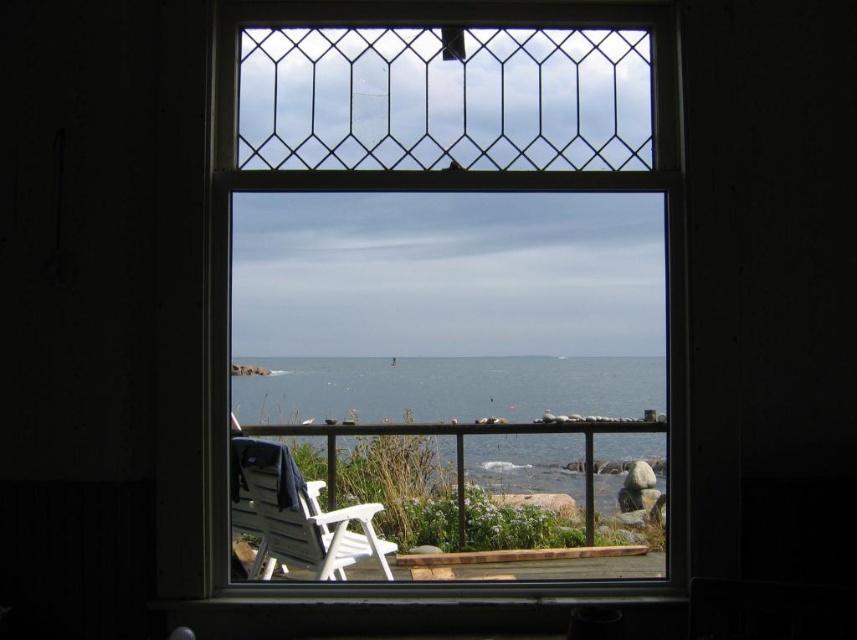
Question: Considering the relative positions of clear glass window at center and white plastic rocking chair at lower center in the image provided, where is clear glass window at center located with respect to white plastic rocking chair at lower center?

Choices:
 (A) above
 (B) below

Answer: (A)

Question: Which point is closer to the camera?

Choices:
 (A) pyautogui.click(x=518, y=525)
 (B) pyautogui.click(x=264, y=404)

Answer: (B)

Question: Considering the relative positions of clear glass window at center and blue water at center in the image provided, where is clear glass window at center located with respect to blue water at center?

Choices:
 (A) left
 (B) right

Answer: (B)

Question: Does blue water at center appear under white plastic rocking chair at lower center?

Choices:
 (A) no
 (B) yes

Answer: (A)

Question: Which object appears closest to the camera in this image?

Choices:
 (A) white plastic rocking chair at lower center
 (B) blue water at center
 (C) clear glass window at center

Answer: (C)

Question: Among these objects, which one is farthest from the camera?

Choices:
 (A) white plastic rocking chair at lower center
 (B) clear glass window at center

Answer: (A)